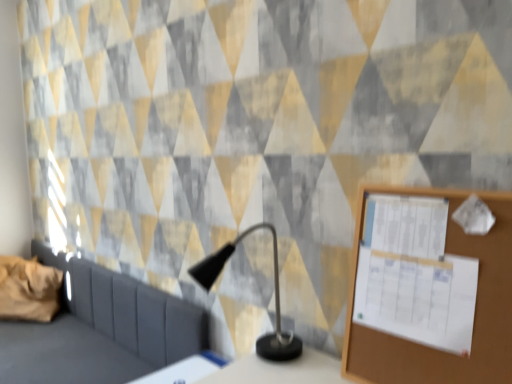
The image size is (512, 384). What do you see at coordinates (185, 370) in the screenshot?
I see `white glossy table at lower center` at bounding box center [185, 370].

In order to click on white glossy table at lower center in this screenshot , I will do `click(185, 370)`.

At what (x,y) coordinates should I click in order to perform the action: click on wooden bulletin board at right. Please return your answer as a coordinate pair (x, y). Image resolution: width=512 pixels, height=384 pixels. Looking at the image, I should click on point(476,307).

Is black matte table lamp at center at the right side of wooden bulletin board at right?

No.

Looking at their sizes, would you say black matte table lamp at center is wider or thinner than wooden bulletin board at right?

In the image, black matte table lamp at center appears to be wider than wooden bulletin board at right.

Is black matte table lamp at center oriented towards wooden bulletin board at right?

No.

Who is shorter, black matte table lamp at center or wooden bulletin board at right?

black matte table lamp at center is shorter.

Is white glossy table at lower center situated inside wooden bulletin board at right or outside?

white glossy table at lower center lies outside wooden bulletin board at right.

From a real-world perspective, is white glossy table at lower center positioned above or below wooden bulletin board at right?

Clearly, from a real-world perspective, white glossy table at lower center is below wooden bulletin board at right.

From the image's perspective, is white glossy table at lower center located beneath wooden bulletin board at right?

Yes.

How many degrees apart are the facing directions of dark gray fabric sofa at left and wooden bulletin board at right?

They differ by 0.114 degrees in their facing directions.

Identify the location of furniture behind the wooden bulletin board at right. (101, 330).

Consider the image. From a real-world perspective, is dark gray fabric sofa at left over wooden bulletin board at right?

Incorrect, from a real-world perspective, dark gray fabric sofa at left is lower than wooden bulletin board at right.

Is dark gray fabric sofa at left oriented towards wooden bulletin board at right?

No, dark gray fabric sofa at left is not aimed at wooden bulletin board at right.

Would you consider brown fabric pillow at left to be distant from dark gray fabric sofa at left?

That's not correct — brown fabric pillow at left is a little close to dark gray fabric sofa at left.

Which is more to the right, brown fabric pillow at left or dark gray fabric sofa at left?

dark gray fabric sofa at left.

Which point is more forward, (30, 318) or (62, 300)?

The point (30, 318) is closer to the camera.

Is brown fabric pillow at left aimed at white glossy table at lower center?

No, brown fabric pillow at left is not oriented towards white glossy table at lower center.

Which is in front, brown fabric pillow at left or white glossy table at lower center?

white glossy table at lower center is more forward.

Considering the relative sizes of brown fabric pillow at left and white glossy table at lower center in the image provided, is brown fabric pillow at left shorter than white glossy table at lower center?

No, brown fabric pillow at left is not shorter than white glossy table at lower center.

Are wooden bulletin board at right and dark gray fabric sofa at left beside each other?

wooden bulletin board at right and dark gray fabric sofa at left are not in contact.

Considering the relative sizes of wooden bulletin board at right and dark gray fabric sofa at left in the image provided, is wooden bulletin board at right wider than dark gray fabric sofa at left?

Incorrect, the width of wooden bulletin board at right does not surpass that of dark gray fabric sofa at left.

Between wooden bulletin board at right and dark gray fabric sofa at left, which one has smaller size?

With smaller size is wooden bulletin board at right.

Relative to dark gray fabric sofa at left, is wooden bulletin board at right in front or behind?

In the image, wooden bulletin board at right appears in front of dark gray fabric sofa at left.

How many degrees apart are the facing directions of wooden bulletin board at right and black matte table lamp at center?

7.61 degrees separate the facing orientations of wooden bulletin board at right and black matte table lamp at center.

Is wooden bulletin board at right to the left or to the right of black matte table lamp at center in the image?

wooden bulletin board at right is positioned on black matte table lamp at center's right side.

Considering their positions, is wooden bulletin board at right located in front of or behind black matte table lamp at center?

Clearly, wooden bulletin board at right is in front of black matte table lamp at center.

The image size is (512, 384). I want to click on table lamp on the left of wooden bulletin board at right, so click(x=254, y=284).

The image size is (512, 384). Identify the location of table behind the wooden bulletin board at right. (185, 370).

Which object lies further to the anchor point dark gray fabric sofa at left, brown fabric pillow at left or white glossy table at lower center?

Based on the image, white glossy table at lower center appears to be further to dark gray fabric sofa at left.

Estimate the real-world distances between objects in this image. Which object is closer to wooden bulletin board at right, brown fabric pillow at left or black matte table lamp at center?

The object closer to wooden bulletin board at right is black matte table lamp at center.

Based on their spatial positions, is white glossy table at lower center or dark gray fabric sofa at left closer to brown fabric pillow at left?

Based on the image, dark gray fabric sofa at left appears to be nearer to brown fabric pillow at left.

Based on their spatial positions, is white glossy table at lower center or wooden bulletin board at right closer to brown fabric pillow at left?

white glossy table at lower center lies closer to brown fabric pillow at left than the other object.

Which object lies nearer to the anchor point wooden bulletin board at right, brown fabric pillow at left or dark gray fabric sofa at left?

dark gray fabric sofa at left.

Based on the photo, estimate the real-world distances between objects in this image. Which object is closer to brown fabric pillow at left, dark gray fabric sofa at left or white glossy table at lower center?

Among the two, dark gray fabric sofa at left is located nearer to brown fabric pillow at left.

Which object lies nearer to the anchor point black matte table lamp at center, white glossy table at lower center or wooden bulletin board at right?

The object closer to black matte table lamp at center is white glossy table at lower center.

From the image, which object appears to be nearer to dark gray fabric sofa at left, brown fabric pillow at left or wooden bulletin board at right?

brown fabric pillow at left.

Locate an element on the screen. Image resolution: width=512 pixels, height=384 pixels. table lamp between brown fabric pillow at left and wooden bulletin board at right in the horizontal direction is located at coordinates (254, 284).

Identify the location of furniture between brown fabric pillow at left and wooden bulletin board at right in the horizontal direction. The height and width of the screenshot is (384, 512). (101, 330).

Locate an element on the screen. This screenshot has height=384, width=512. table between dark gray fabric sofa at left and brown fabric pillow at left from front to back is located at coordinates (185, 370).

Locate an element on the screen. table between dark gray fabric sofa at left and black matte table lamp at center from left to right is located at coordinates (185, 370).